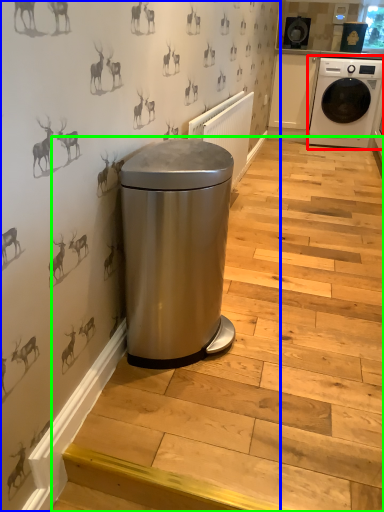
Question: Estimate the real-world distances between objects in this image. Which object is farther from washing machine (highlighted by a red box), backdrop (highlighted by a blue box) or stairwell (highlighted by a green box)?

Choices:
 (A) backdrop
 (B) stairwell

Answer: (A)